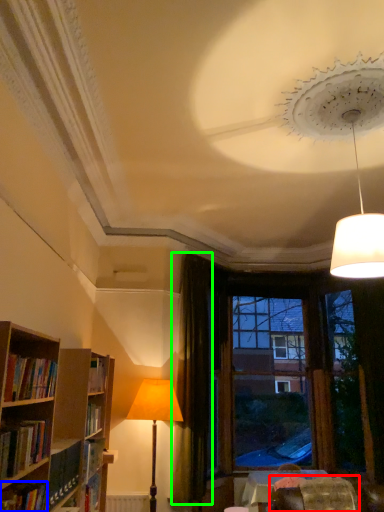
Question: Which object is positioned farthest from swivel chair (highlighted by a red box)? Select from book (highlighted by a blue box) and curtain (highlighted by a green box).

Choices:
 (A) book
 (B) curtain

Answer: (A)